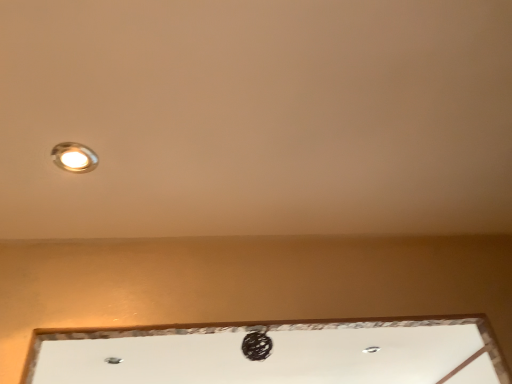
Question: Considering the positions of white glossy window at center and matte silver lamp at upper left in the image, is white glossy window at center wider or thinner than matte silver lamp at upper left?

Choices:
 (A) thin
 (B) wide

Answer: (B)

Question: Is point (443, 344) closer or farther from the camera than point (66, 162)?

Choices:
 (A) closer
 (B) farther

Answer: (B)

Question: From a real-world perspective, is white glossy window at center above or below matte silver lamp at upper left?

Choices:
 (A) above
 (B) below

Answer: (A)

Question: From their relative heights in the image, would you say matte silver lamp at upper left is taller or shorter than white glossy window at center?

Choices:
 (A) short
 (B) tall

Answer: (A)

Question: Considering their positions, is matte silver lamp at upper left located in front of or behind white glossy window at center?

Choices:
 (A) behind
 (B) front

Answer: (B)

Question: Would you say matte silver lamp at upper left is to the left or to the right of white glossy window at center in the picture?

Choices:
 (A) left
 (B) right

Answer: (A)

Question: From a real-world perspective, is matte silver lamp at upper left above or below white glossy window at center?

Choices:
 (A) above
 (B) below

Answer: (B)